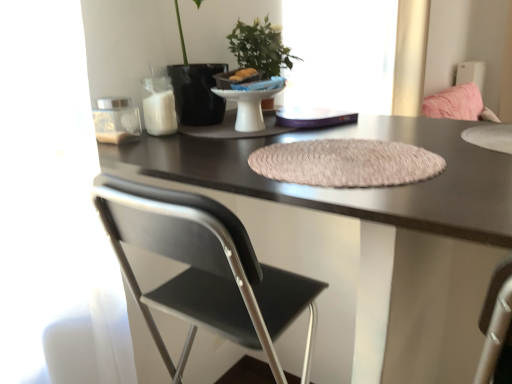
You are a GUI agent. You are given a task and a screenshot of the screen. Output one action in this format:
    pyautogui.click(x=<x>, y=<y>)
    Task: Click on the beige textured placemat at center
    
    Given the screenshot: What is the action you would take?
    pyautogui.click(x=346, y=163)

What do you see at coordinates (205, 270) in the screenshot? I see `black matte chair at center` at bounding box center [205, 270].

In order to face black matte chair at center, should I rotate leftwards or rightwards?

You should rotate left by 6.123 degrees.

Measure the distance between point (282, 58) and camera.

The distance of point (282, 58) from camera is 4.37 feet.

The image size is (512, 384). Identify the location of beige textured placemat at center. (346, 163).

Does transparent glass window at upper center come behind beige textured placemat at center?

Yes, transparent glass window at upper center is further from the viewer.

Is transparent glass window at upper center facing away from beige textured placemat at center?

That's not correct — transparent glass window at upper center is not looking away from beige textured placemat at center.

At what (x,y) coordinates should I click in order to perform the action: click on mat located underneath the transparent glass window at upper center (from a real-world perspective). Please return your answer as a coordinate pair (x, y). Looking at the image, I should click on (346, 163).

From a real-world perspective, who is located higher, transparent glass window at upper center or green matte plant at upper center?

In real-world perspective, green matte plant at upper center is above.

From the picture: From the image's perspective, which one is positioned lower, transparent glass window at upper center or green matte plant at upper center?

green matte plant at upper center, from the image's perspective.

Locate an element on the screen. window above the green matte plant at upper center (from the image's perspective) is located at coordinates (341, 53).

Is transparent glass window at upper center inside the boundaries of green matte plant at upper center, or outside?

transparent glass window at upper center lies outside green matte plant at upper center.

Does point (420, 168) come farther from viewer compared to point (361, 8)?

No.

Consider the image. Would you consider beige textured placemat at center to be distant from transparent glass window at upper center?

Yes, beige textured placemat at center and transparent glass window at upper center are quite far apart.

Considering the positions of objects beige textured placemat at center and transparent glass window at upper center in the image provided, who is more to the left, beige textured placemat at center or transparent glass window at upper center?

beige textured placemat at center is more to the left.

Is matte black desk at center facing towards black matte chair at center?

Yes, matte black desk at center is turned towards black matte chair at center.

Which of these two, matte black desk at center or black matte chair at center, is wider?

With larger width is matte black desk at center.

Which object is closer to the camera taking this photo, matte black desk at center or black matte chair at center?

matte black desk at center is in front.

Measure the distance between green matte plant at upper center and transparent glass window at upper center.

green matte plant at upper center is 27.72 inches away from transparent glass window at upper center.

Would you consider green matte plant at upper center to be distant from transparent glass window at upper center?

No, green matte plant at upper center is not far from transparent glass window at upper center.

Considering the sizes of objects green matte plant at upper center and transparent glass window at upper center in the image provided, who is shorter, green matte plant at upper center or transparent glass window at upper center?

Standing shorter between the two is green matte plant at upper center.

From a real-world perspective, which is physically above, green matte plant at upper center or transparent glass window at upper center?

green matte plant at upper center, from a real-world perspective.

Identify the location of chair below the green matte plant at upper center (from the image's perspective). The width and height of the screenshot is (512, 384). [x=205, y=270].

From a real-world perspective, is green matte plant at upper center positioned over black matte chair at center based on gravity?

Yes, from a real-world perspective, green matte plant at upper center is above black matte chair at center.

From the image's perspective, who appears lower, green matte plant at upper center or black matte chair at center?

black matte chair at center is shown below in the image.

Is green matte plant at upper center completely or partially outside of black matte chair at center?

Yes, green matte plant at upper center is located beyond the bounds of black matte chair at center.

From the image's perspective, which is above, black matte chair at center or transparent glass window at upper center?

transparent glass window at upper center is shown above in the image.

Between black matte chair at center and transparent glass window at upper center, which one is positioned in front?

black matte chair at center is in front.

Is black matte chair at center positioned with its back to transparent glass window at upper center?

black matte chair at center does not have its back to transparent glass window at upper center.

At what (x,y) coordinates should I click in order to perform the action: click on chair lying on the left of transparent glass window at upper center. Please return your answer as a coordinate pair (x, y). The image size is (512, 384). Looking at the image, I should click on (205, 270).

You are a GUI agent. You are given a task and a screenshot of the screen. Output one action in this format:
    pyautogui.click(x=<x>, y=<y>)
    Task: Click on the mat in front of the transparent glass window at upper center
    The height and width of the screenshot is (384, 512).
    Given the screenshot: What is the action you would take?
    pyautogui.click(x=346, y=163)

The height and width of the screenshot is (384, 512). Find the location of `houseplant below the transparent glass window at upper center (from the image's perspective)`. houseplant below the transparent glass window at upper center (from the image's perspective) is located at coordinates (260, 47).

Considering their positions, is green matte plant at upper center positioned further to beige textured placemat at center than matte black desk at center?

green matte plant at upper center is further to beige textured placemat at center.

When comparing their distances from black matte chair at center, does matte black desk at center or transparent glass window at upper center seem further?

Among the two, transparent glass window at upper center is located further to black matte chair at center.

Considering their positions, is beige textured placemat at center positioned further to black matte chair at center than transparent glass window at upper center?

The object further to black matte chair at center is transparent glass window at upper center.

Which object lies further to the anchor point black matte chair at center, beige textured placemat at center or matte black desk at center?

beige textured placemat at center is further to black matte chair at center.

Which object lies further to the anchor point transparent glass window at upper center, green matte plant at upper center or matte black desk at center?

Based on the image, matte black desk at center appears to be further to transparent glass window at upper center.

When comparing their distances from transparent glass window at upper center, does black matte chair at center or matte black desk at center seem closer?

matte black desk at center is closer to transparent glass window at upper center.

In the scene shown: From the image, which object appears to be nearer to matte black desk at center, beige textured placemat at center or transparent glass window at upper center?

beige textured placemat at center.

Considering their positions, is green matte plant at upper center positioned further to beige textured placemat at center than transparent glass window at upper center?

The object further to beige textured placemat at center is transparent glass window at upper center.

At what (x,y) coordinates should I click in order to perform the action: click on houseplant between beige textured placemat at center and transparent glass window at upper center in the front-back direction. Please return your answer as a coordinate pair (x, y). This screenshot has width=512, height=384. Looking at the image, I should click on (260, 47).

Where is `mat located between black matte chair at center and transparent glass window at upper center in the depth direction`? Image resolution: width=512 pixels, height=384 pixels. mat located between black matte chair at center and transparent glass window at upper center in the depth direction is located at coordinates (346, 163).

Find the location of a particular element. The height and width of the screenshot is (384, 512). mat that lies between green matte plant at upper center and matte black desk at center from top to bottom is located at coordinates (346, 163).

The image size is (512, 384). I want to click on mat between matte black desk at center and transparent glass window at upper center along the z-axis, so click(x=346, y=163).